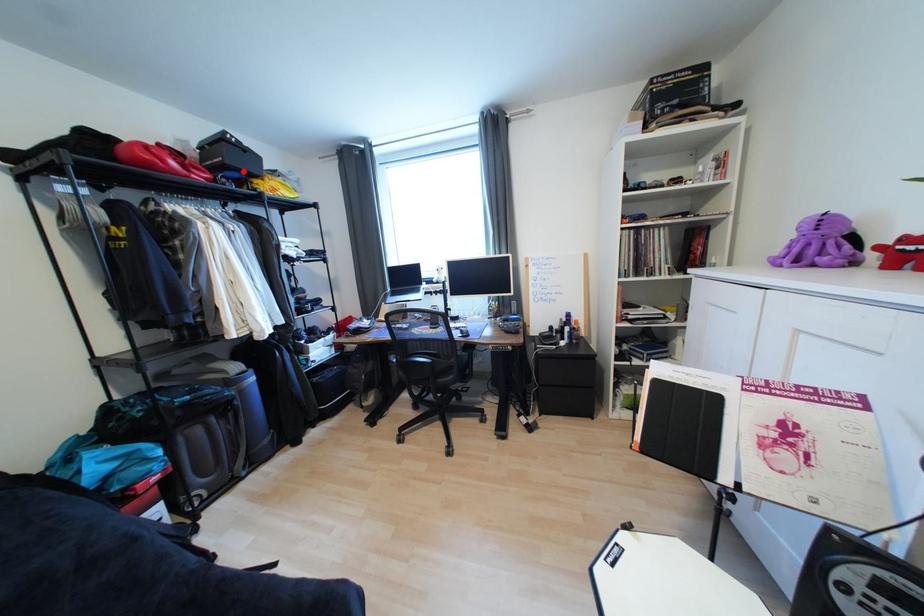
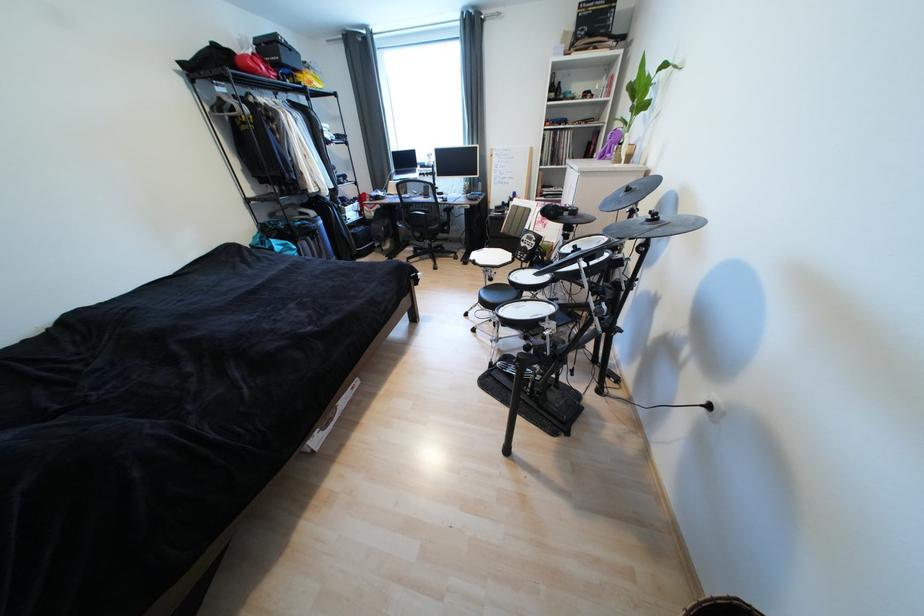
In the second image, find the point that corresponds to the highlighted location in the first image.

(294, 68)